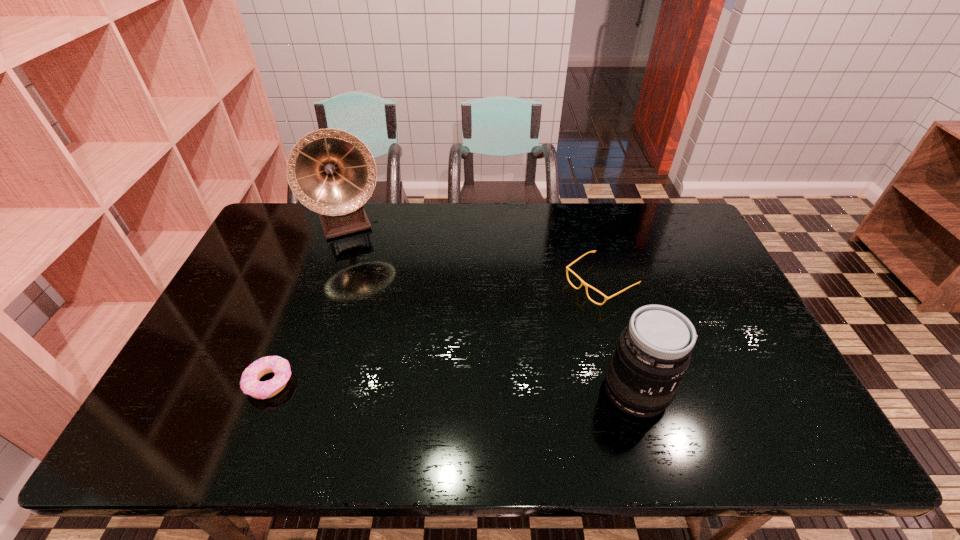
You are a GUI agent. You are given a task and a screenshot of the screen. Output one action in this format:
    pyautogui.click(x=<x>, y=<y>)
    Task: Click on the vacant space at the right edge
    
    Given the screenshot: What is the action you would take?
    pyautogui.click(x=689, y=293)

Identify the location of free space between the shortest object and the second tallest object. This screenshot has height=540, width=960. (453, 386).

You are a GUI agent. You are given a task and a screenshot of the screen. Output one action in this format:
    pyautogui.click(x=<x>, y=<y>)
    Task: Click on the free space between the shortest object and the phonograph record
    Image resolution: width=960 pixels, height=540 pixels.
    Given the screenshot: What is the action you would take?
    pyautogui.click(x=310, y=303)

The height and width of the screenshot is (540, 960). Find the location of `unoccupied position between the doughnut and the third nearest object`. unoccupied position between the doughnut and the third nearest object is located at coordinates (435, 333).

You are a GUI agent. You are given a task and a screenshot of the screen. Output one action in this format:
    pyautogui.click(x=<x>, y=<y>)
    Task: Click on the free space that is in between the shortest object and the spectacles
    
    Given the screenshot: What is the action you would take?
    pyautogui.click(x=435, y=333)

The height and width of the screenshot is (540, 960). Identify the location of empty space that is in between the third shortest object and the second farthest object. (618, 336).

Identify the location of vacant space in between the farthest object and the third nearest object. (475, 253).

I want to click on vacant space that's between the third shortest object and the phonograph record, so click(493, 307).

Locate an element on the screen. free area in between the doughnut and the phonograph record is located at coordinates (310, 303).

Where is `vacant space in between the phonograph record and the telephoto lens`? vacant space in between the phonograph record and the telephoto lens is located at coordinates (493, 307).